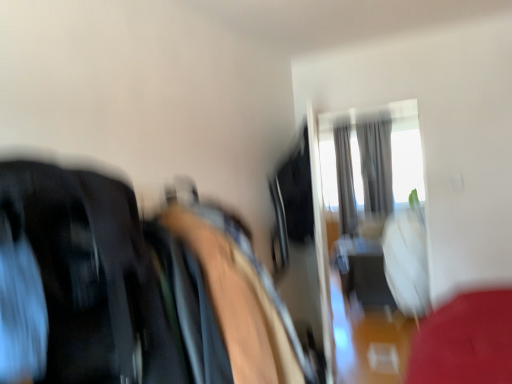
Question: Is silky gray curtain at upper center, placed as the 2th curtain when sorted from right to left, next to transparent glass door at upper center?

Choices:
 (A) yes
 (B) no

Answer: (B)

Question: Is transparent glass door at upper center located within silky gray curtain at upper center, placed as the 2th curtain when sorted from right to left?

Choices:
 (A) no
 (B) yes

Answer: (A)

Question: Considering the relative sizes of silky gray curtain at upper center, placed as the 2th curtain when sorted from right to left, and transparent glass door at upper center in the image provided, is silky gray curtain at upper center, placed as the 2th curtain when sorted from right to left, bigger than transparent glass door at upper center?

Choices:
 (A) no
 (B) yes

Answer: (B)

Question: Can you confirm if silky gray curtain at upper center, placed as the 2th curtain when sorted from right to left, is taller than transparent glass door at upper center?

Choices:
 (A) no
 (B) yes

Answer: (B)

Question: Could you tell me if silky gray curtain at upper center, acting as the 1th curtain starting from the left, is facing transparent glass door at upper center?

Choices:
 (A) no
 (B) yes

Answer: (A)

Question: Can you confirm if silky gray curtain at upper center, placed as the 2th curtain when sorted from right to left, is thinner than transparent glass door at upper center?

Choices:
 (A) yes
 (B) no

Answer: (B)

Question: Does gray fabric curtain at upper right, which appears as the 2th curtain when viewed from the left, have a lesser height compared to transparent glass door at upper center?

Choices:
 (A) no
 (B) yes

Answer: (B)

Question: From a real-world perspective, is gray fabric curtain at upper right, which appears as the 2th curtain when viewed from the left, positioned under transparent glass door at upper center based on gravity?

Choices:
 (A) yes
 (B) no

Answer: (B)

Question: Is gray fabric curtain at upper right, which appears as the 2th curtain when viewed from the left, located outside transparent glass door at upper center?

Choices:
 (A) yes
 (B) no

Answer: (A)

Question: Considering the relative positions of gray fabric curtain at upper right, which appears as the 2th curtain when viewed from the left, and transparent glass door at upper center in the image provided, is gray fabric curtain at upper right, which appears as the 2th curtain when viewed from the left, in front of transparent glass door at upper center?

Choices:
 (A) yes
 (B) no

Answer: (B)

Question: Could you tell me if gray fabric curtain at upper right, which appears as the 2th curtain when viewed from the left, is turned towards transparent glass door at upper center?

Choices:
 (A) yes
 (B) no

Answer: (A)

Question: Considering the relative sizes of gray fabric curtain at upper right, which appears as the 2th curtain when viewed from the left, and transparent glass door at upper center in the image provided, is gray fabric curtain at upper right, which appears as the 2th curtain when viewed from the left, taller than transparent glass door at upper center?

Choices:
 (A) yes
 (B) no

Answer: (B)

Question: From the image's perspective, does gray fabric curtain at upper right, which appears as the 2th curtain when viewed from the left, appear lower than silky gray curtain at upper center, acting as the 1th curtain starting from the left?

Choices:
 (A) no
 (B) yes

Answer: (A)